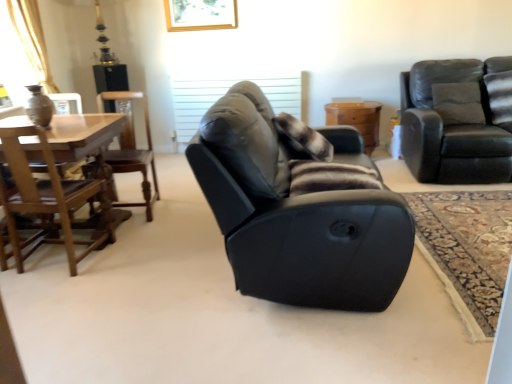
Question: Would you say brown fuzzy pillow at center contains wooden chair at left, placed as the second chair when sorted from left to right?

Choices:
 (A) yes
 (B) no

Answer: (B)

Question: Considering the relative sizes of brown fuzzy pillow at center and wooden chair at left, placed as the second chair when sorted from left to right, in the image provided, is brown fuzzy pillow at center thinner than wooden chair at left, placed as the second chair when sorted from left to right,?

Choices:
 (A) no
 (B) yes

Answer: (B)

Question: Is brown fuzzy pillow at center aimed at wooden chair at left, marked as the 3th chair in a right-to-left arrangement?

Choices:
 (A) yes
 (B) no

Answer: (B)

Question: Is brown fuzzy pillow at center positioned with its back to wooden chair at left, marked as the 3th chair in a right-to-left arrangement?

Choices:
 (A) yes
 (B) no

Answer: (A)

Question: Are brown fuzzy pillow at center and wooden chair at left, marked as the 3th chair in a right-to-left arrangement, located far from each other?

Choices:
 (A) yes
 (B) no

Answer: (A)

Question: Is black leather recliner at center, which appears as the 2th chair when viewed from the right, inside the boundaries of wooden chair at left, the 4th chair from the right, or outside?

Choices:
 (A) outside
 (B) inside

Answer: (A)

Question: Considering the positions of black leather recliner at center, the 3th chair in the left-to-right sequence, and wooden chair at left, marked as the 1th chair in a left-to-right arrangement, in the image, is black leather recliner at center, the 3th chair in the left-to-right sequence, bigger or smaller than wooden chair at left, marked as the 1th chair in a left-to-right arrangement,?

Choices:
 (A) small
 (B) big

Answer: (B)

Question: Is black leather recliner at center, which appears as the 2th chair when viewed from the right, in front of or behind wooden chair at left, marked as the 1th chair in a left-to-right arrangement, in the image?

Choices:
 (A) behind
 (B) front

Answer: (B)

Question: Looking at their shapes, would you say black leather recliner at center, which appears as the 2th chair when viewed from the right, is wider or thinner than wooden chair at left, marked as the 1th chair in a left-to-right arrangement?

Choices:
 (A) wide
 (B) thin

Answer: (A)

Question: In terms of height, does black leather recliner at center, the 3th chair in the left-to-right sequence, look taller or shorter compared to brown fuzzy pillow at center?

Choices:
 (A) short
 (B) tall

Answer: (B)

Question: Is black leather recliner at center, the 3th chair in the left-to-right sequence, bigger or smaller than brown fuzzy pillow at center?

Choices:
 (A) small
 (B) big

Answer: (B)

Question: From a real-world perspective, is black leather recliner at center, which appears as the 2th chair when viewed from the right, above or below brown fuzzy pillow at center?

Choices:
 (A) below
 (B) above

Answer: (A)

Question: Looking at their shapes, would you say black leather recliner at center, the 3th chair in the left-to-right sequence, is wider or thinner than brown fuzzy pillow at center?

Choices:
 (A) thin
 (B) wide

Answer: (B)

Question: Is point (500, 59) closer or farther from the camera than point (138, 148)?

Choices:
 (A) farther
 (B) closer

Answer: (B)

Question: Is velvet dark gray couch at upper right, which is counted as the 4th chair, starting from the left, to the left or to the right of wooden chair at left, marked as the 3th chair in a right-to-left arrangement, in the image?

Choices:
 (A) right
 (B) left

Answer: (A)